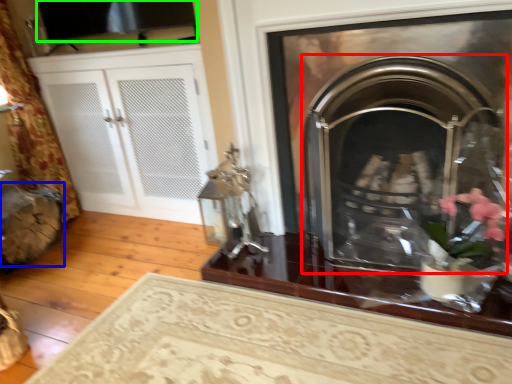
Question: Considering the real-world distances, which object is farthest from fireplace (highlighted by a red box)? chair (highlighted by a blue box) or window screen (highlighted by a green box)?

Choices:
 (A) chair
 (B) window screen

Answer: (A)